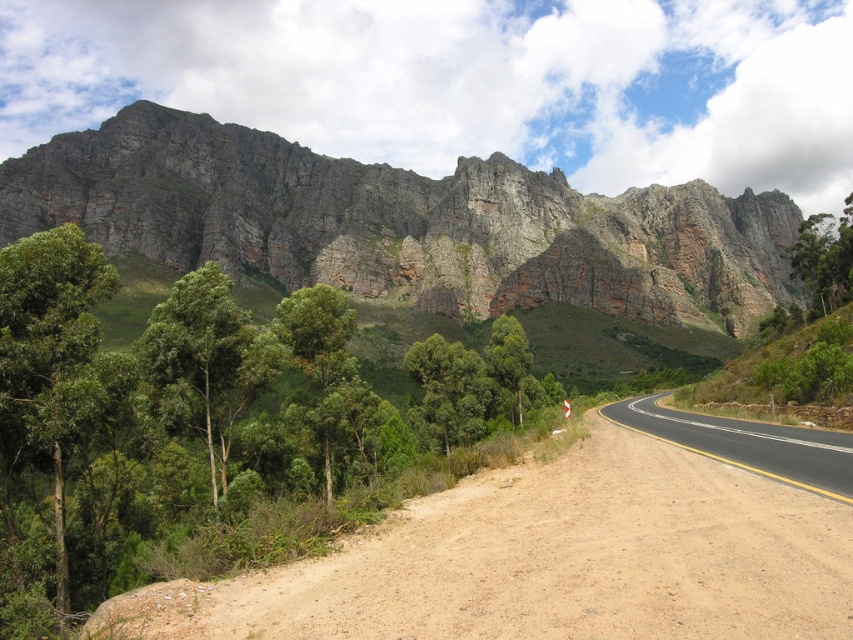
Does green leafy tree at left have a lesser height compared to green smooth tree at center?

Indeed, green leafy tree at left has a lesser height compared to green smooth tree at center.

Between green leafy tree at left and green smooth tree at center, which one has less height?

With less height is green leafy tree at left.

Which is in front, point (271, 534) or point (194, 275)?

Positioned in front is point (271, 534).

Locate an element on the screen. green leafy tree at left is located at coordinates (209, 429).

Can you confirm if green leafy tree at left is positioned to the left of dirt road at lower left?

Correct, you'll find green leafy tree at left to the left of dirt road at lower left.

Measure the distance from green leafy tree at left to dirt road at lower left.

green leafy tree at left and dirt road at lower left are 17.35 meters apart.

Describe the element at coordinates (209, 429) in the screenshot. I see `green leafy tree at left` at that location.

Find the location of `green leafy tree at left`. green leafy tree at left is located at coordinates (209, 429).

Between green leafy tree at left and green leafy tree at right, which one has more height?

green leafy tree at right is taller.

Consider the image. Does green leafy tree at left have a greater width compared to green leafy tree at right?

In fact, green leafy tree at left might be narrower than green leafy tree at right.

Is point (552, 394) more distant than point (845, 278)?

Yes, it is behind point (845, 278).

Where is `green leafy tree at left`? green leafy tree at left is located at coordinates (209, 429).